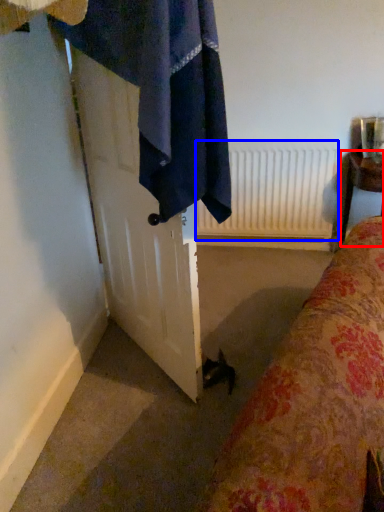
Question: Which object is further to the camera taking this photo, furniture (highlighted by a red box) or radiator (highlighted by a blue box)?

Choices:
 (A) furniture
 (B) radiator

Answer: (B)